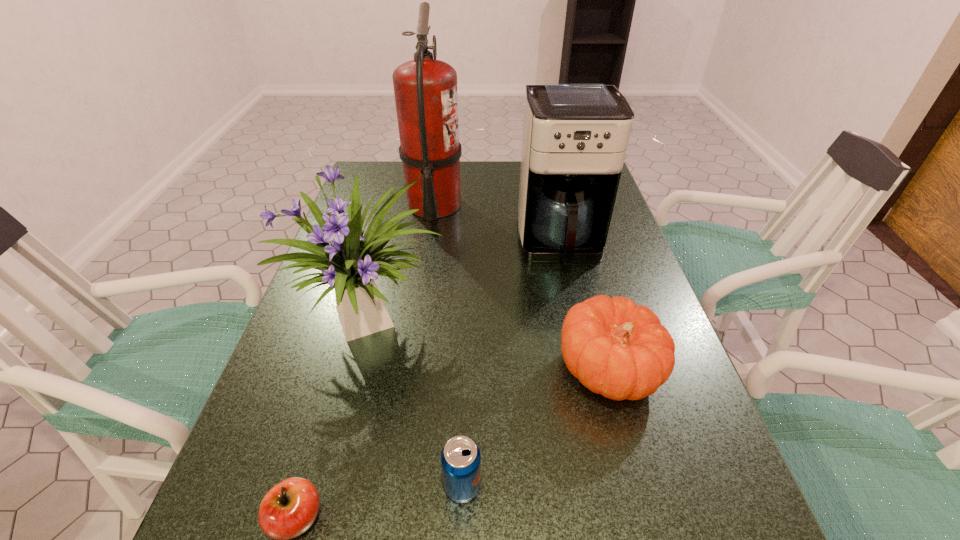
Locate an element on the screen. The width and height of the screenshot is (960, 540). fire extinguisher is located at coordinates pyautogui.click(x=425, y=89).

This screenshot has height=540, width=960. Find the location of `coffee maker`. coffee maker is located at coordinates (575, 135).

The image size is (960, 540). What are the coordinates of `flower arrangement` in the screenshot? It's located at point(351,262).

You are a GUI agent. You are given a task and a screenshot of the screen. Output one action in this format:
    pyautogui.click(x=<x>, y=<y>)
    Task: Click on the third shortest object
    
    Given the screenshot: What is the action you would take?
    pyautogui.click(x=615, y=348)

Identify the location of the fifth tallest object. (460, 458).

Identify the location of free location located toward the nozzle of the tallest object. (489, 206).

You are a GUI agent. You are given a task and a screenshot of the screen. Output one action in this format:
    pyautogui.click(x=<x>, y=<y>)
    Task: Click on the vacant space located on the front panel of the coffee maker
    
    Given the screenshot: What is the action you would take?
    pyautogui.click(x=585, y=356)

At what (x,y) coordinates should I click in order to perform the action: click on vacant space located 0.100m on the right of the flower arrangement. Please return your answer as a coordinate pair (x, y). The height and width of the screenshot is (540, 960). Looking at the image, I should click on 495,322.

The image size is (960, 540). I want to click on blank area located 0.220m on the left of the fourth tallest object, so click(448, 370).

At what (x,y) coordinates should I click in order to perform the action: click on vacant space situated 0.370m on the back of the pop soda. Please return your answer as a coordinate pair (x, y). Looking at the image, I should click on (x=468, y=311).